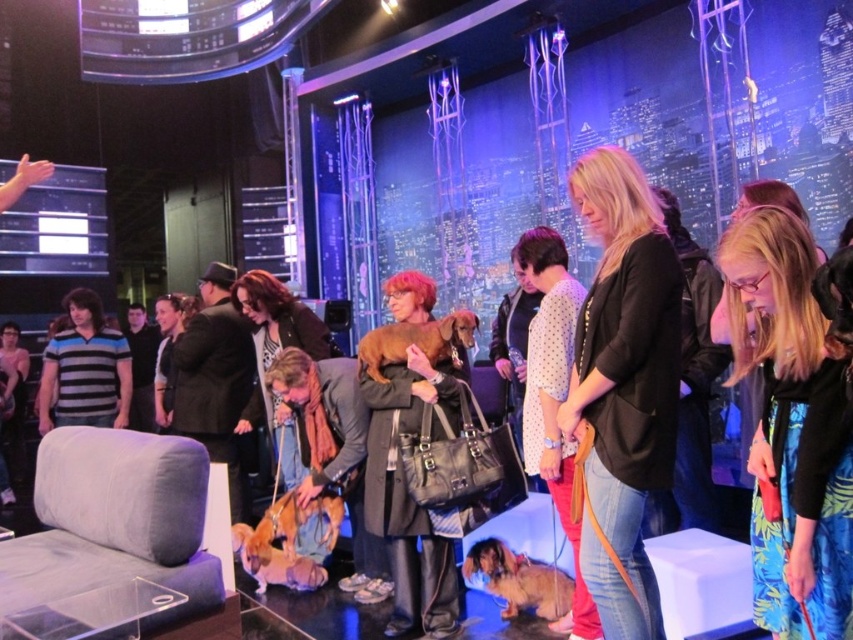
Question: Which object appears farthest from the camera in this image?

Choices:
 (A) soft brown fur at center
 (B) shiny brown fur at lower center
 (C) black matte blazer at center

Answer: (A)

Question: Is striped cotton shirt at left wider than shiny brown fur at lower center?

Choices:
 (A) no
 (B) yes

Answer: (B)

Question: Which point appears closest to the camera in this image?

Choices:
 (A) (231, 531)
 (B) (657, 388)

Answer: (B)

Question: Is blue floral skirt at lower right to the left of matte black coat at center from the viewer's perspective?

Choices:
 (A) yes
 (B) no

Answer: (B)

Question: Can you confirm if black matte blazer at center is smaller than brown furry dog at center?

Choices:
 (A) yes
 (B) no

Answer: (B)

Question: Which point is closer to the camera?

Choices:
 (A) (161, 424)
 (B) (442, 572)

Answer: (B)